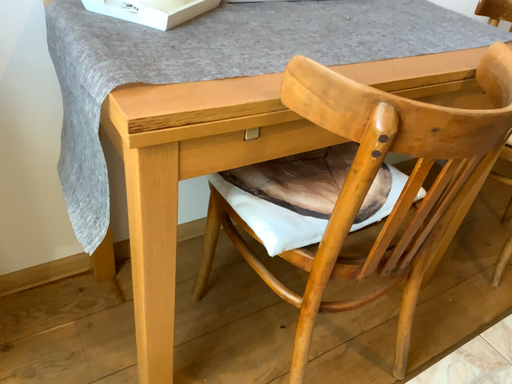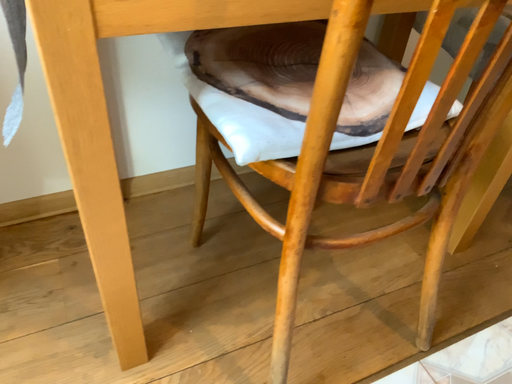
Question: How did the camera likely rotate when shooting the video?

Choices:
 (A) rotated right
 (B) rotated left

Answer: (B)